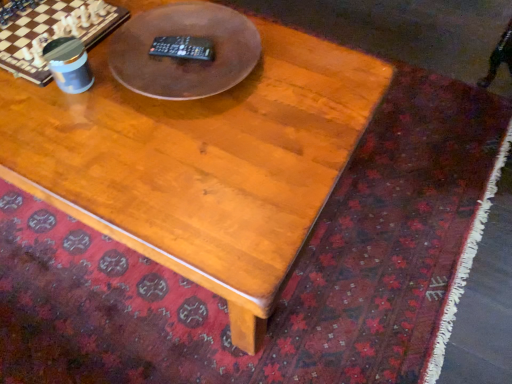
Question: Is brown wooden table at center at the back of wooden coffee table at center?

Choices:
 (A) no
 (B) yes

Answer: (A)

Question: From a real-world perspective, is wooden coffee table at center on brown wooden table at center?

Choices:
 (A) yes
 (B) no

Answer: (B)

Question: Is there a large distance between wooden coffee table at center and brown wooden table at center?

Choices:
 (A) yes
 (B) no

Answer: (B)

Question: Is wooden coffee table at center smaller than brown wooden table at center?

Choices:
 (A) no
 (B) yes

Answer: (A)

Question: Is wooden coffee table at center bigger than brown wooden table at center?

Choices:
 (A) yes
 (B) no

Answer: (A)

Question: Does wooden coffee table at center have a lesser height compared to brown wooden table at center?

Choices:
 (A) yes
 (B) no

Answer: (B)

Question: Is brown wooden table at center positioned in front of wooden coffee table at center?

Choices:
 (A) yes
 (B) no

Answer: (B)

Question: Is wooden coffee table at center at the back of brown wooden table at center?

Choices:
 (A) yes
 (B) no

Answer: (B)

Question: From the image's perspective, is brown wooden table at center under wooden coffee table at center?

Choices:
 (A) no
 (B) yes

Answer: (A)

Question: Considering the relative sizes of brown wooden table at center and wooden coffee table at center in the image provided, is brown wooden table at center thinner than wooden coffee table at center?

Choices:
 (A) yes
 (B) no

Answer: (A)

Question: Are brown wooden table at center and wooden coffee table at center far apart?

Choices:
 (A) yes
 (B) no

Answer: (B)

Question: Can you confirm if brown wooden table at center is wider than wooden coffee table at center?

Choices:
 (A) yes
 (B) no

Answer: (B)

Question: Does point (12, 144) appear closer or farther from the camera than point (227, 61)?

Choices:
 (A) farther
 (B) closer

Answer: (B)